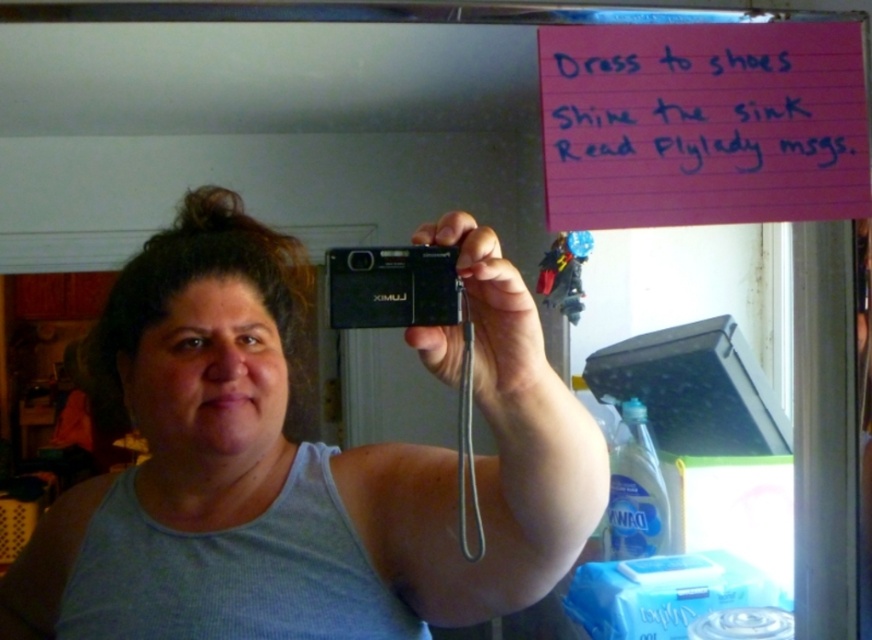
Question: Is the position of matte black camera at upper center more distant than that of black plastic camera at upper center?

Choices:
 (A) yes
 (B) no

Answer: (A)

Question: Does matte black camera at upper center lie behind black plastic camera at upper center?

Choices:
 (A) no
 (B) yes

Answer: (B)

Question: Is matte black camera at upper center smaller than black plastic camera at upper center?

Choices:
 (A) no
 (B) yes

Answer: (A)

Question: Which object is farther from the camera taking this photo?

Choices:
 (A) matte black camera at upper center
 (B) black plastic camera at upper center
 (C) pink paper at upper right

Answer: (C)

Question: Among these points, which one is farthest from the camera?

Choices:
 (A) (358, 262)
 (B) (337, 637)
 (C) (699, 92)

Answer: (B)

Question: Which of the following is the farthest from the observer?

Choices:
 (A) (753, 35)
 (B) (338, 248)

Answer: (B)